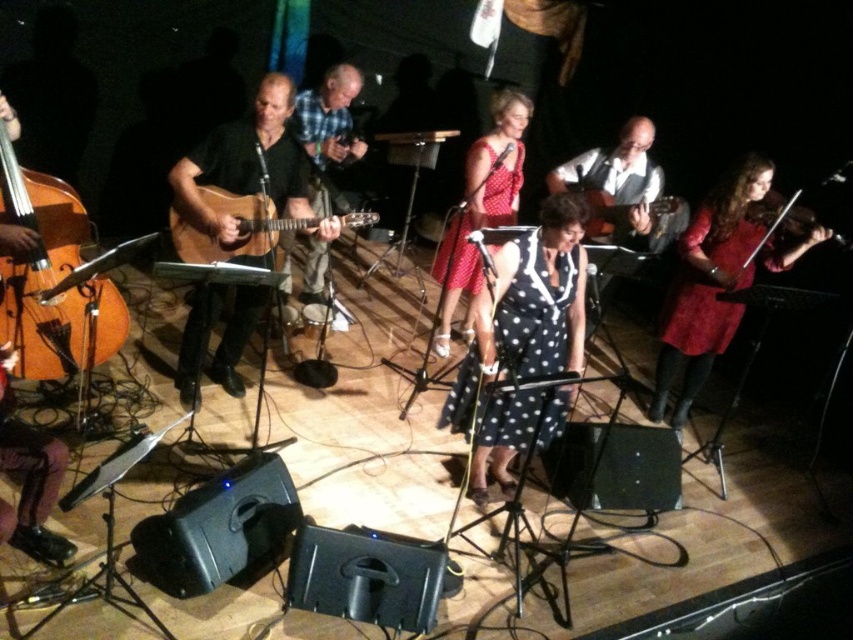
Question: Which object is the closest to the matte purple tights at lower left?

Choices:
 (A) acoustic guitar at center
 (B) wooden violin at right
 (C) red velvet coat at right
 (D) red polka dot dress at center

Answer: (A)

Question: Estimate the real-world distances between objects in this image. Which object is closer to the matte black guitar at center?

Choices:
 (A) wooden violin at right
 (B) black dotted dress at center

Answer: (B)

Question: Does black polka dot dress at center appear over red velvet coat at right?

Choices:
 (A) no
 (B) yes

Answer: (A)

Question: Does matte purple tights at lower left have a lesser width compared to wooden violin at right?

Choices:
 (A) no
 (B) yes

Answer: (B)

Question: Among these objects, which one is farthest from the camera?

Choices:
 (A) plaid fabric shirt at center
 (B) black polka dot dress at center
 (C) orange matte cello at left
 (D) red polka dot dress at center

Answer: (D)

Question: Does orange matte cello at left appear under acoustic guitar at center?

Choices:
 (A) no
 (B) yes

Answer: (B)